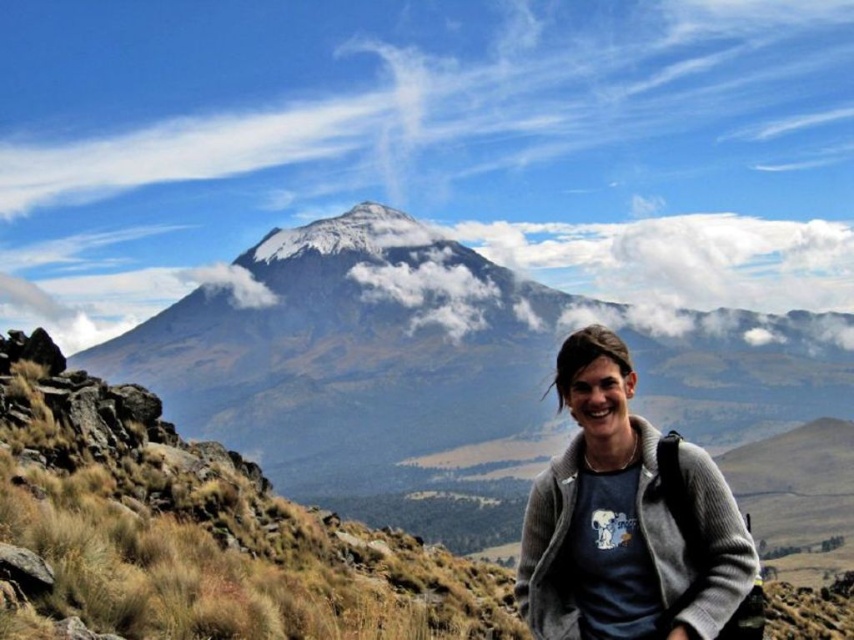
You are planning to take a photo of the snowy rock mountain at center and the gray woolen sweater at center. Which object should you focus on first if you want to ensure both are in the frame without zooming in or out?

You should focus on the snowy rock mountain at center first because it is wider than the gray woolen sweater at center, so it requires more space in the frame.

You are a photographer trying to capture the snowy rock mountain at center and the gray woolen sweater at center in a single frame. Considering their sizes, which object will appear larger in the photo?

The snowy rock mountain at center will appear larger in the photo because it is bigger than the gray woolen sweater at center.